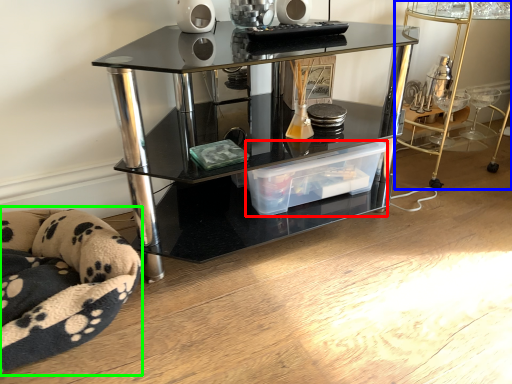
Question: Which object is the farthest from storage box (highlighted by a red box)? Choose among these: table (highlighted by a blue box) or swivel chair (highlighted by a green box).

Choices:
 (A) table
 (B) swivel chair

Answer: (A)